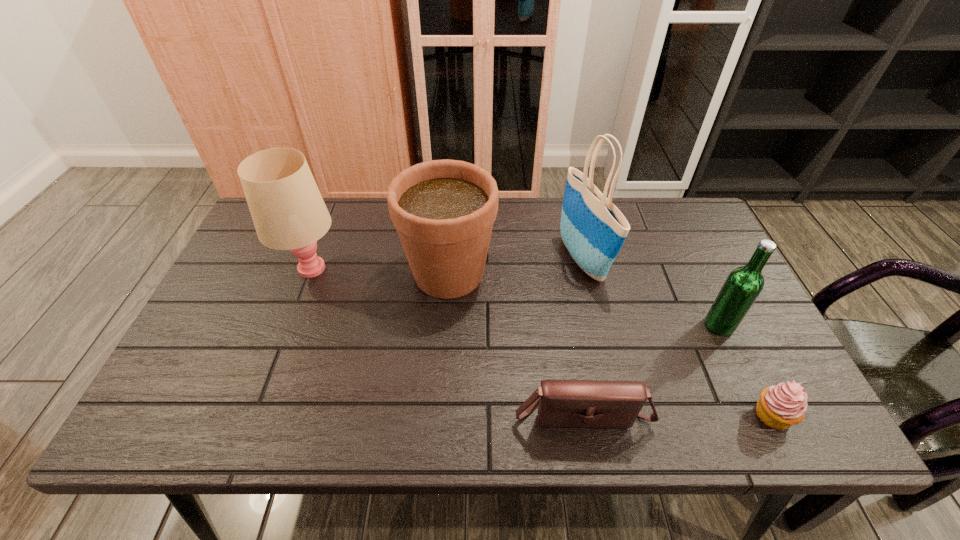
This screenshot has width=960, height=540. Find the location of `object located at the near right corner`. object located at the near right corner is located at coordinates (779, 407).

You are a GUI agent. You are given a task and a screenshot of the screen. Output one action in this format:
    pyautogui.click(x=<x>, y=<y>)
    Task: Click on the vacant point at the far edge
    
    Given the screenshot: What is the action you would take?
    pyautogui.click(x=350, y=235)

This screenshot has height=540, width=960. I want to click on blank area at the near edge, so click(x=418, y=413).

In the image, there is a desktop. Where is `free space at the left edge`? This screenshot has width=960, height=540. free space at the left edge is located at coordinates (196, 361).

Where is `vacant space at the right edge of the desktop`? The height and width of the screenshot is (540, 960). vacant space at the right edge of the desktop is located at coordinates (752, 361).

Find the location of a particular element. This screenshot has height=540, width=960. vacant area at the far right corner of the desktop is located at coordinates (677, 212).

Locate an element on the screen. This screenshot has width=960, height=540. vacant point located between the shortest object and the beer bottle is located at coordinates (746, 370).

Find the location of `free space between the beer bottle and the shoulder bag`. free space between the beer bottle and the shoulder bag is located at coordinates (651, 368).

Locate an element on the screen. free spot between the leftmost object and the fifth object from right to left is located at coordinates (380, 271).

I want to click on empty space that is in between the third nearest object and the tote bag, so click(x=651, y=293).